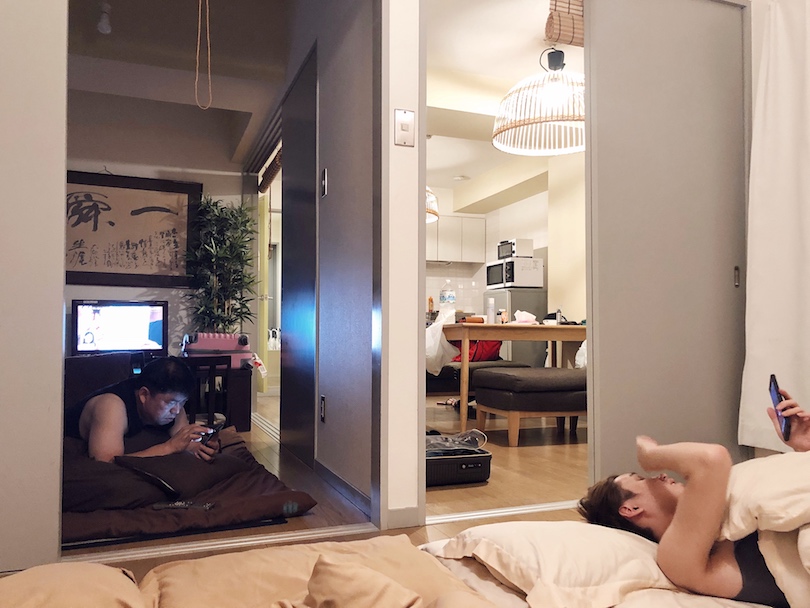
Locate an element on the screen. The image size is (810, 608). television screen is located at coordinates (118, 329).